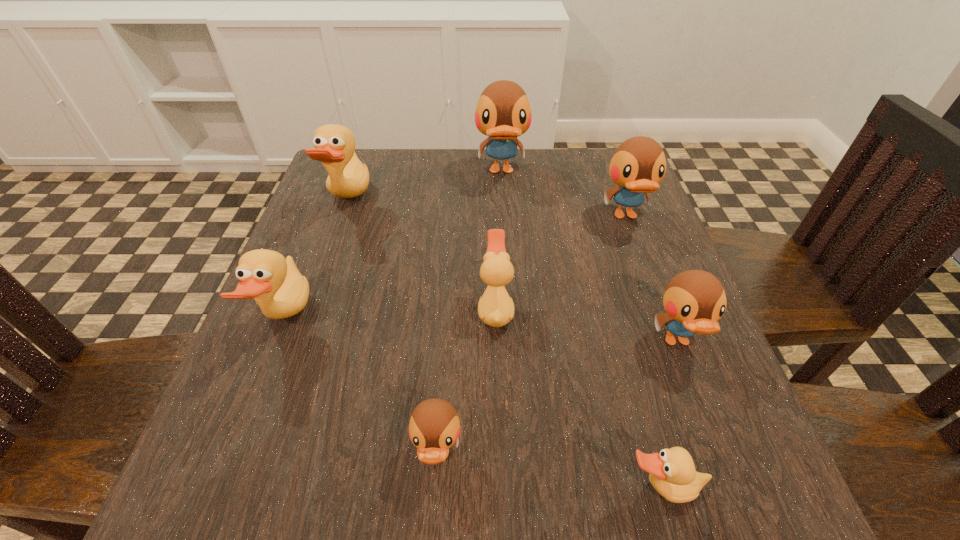
Locate an element on the screen. the rightmost tan duck is located at coordinates (672, 472).

The width and height of the screenshot is (960, 540). What are the coordinates of `vacant area situated on the front-facing side of the farthest blue duck` in the screenshot? It's located at (507, 259).

Locate an element on the screen. The image size is (960, 540). free space located on the beak of the biggest tan duck is located at coordinates point(460,201).

Identify the location of vacant space located on the front-facing side of the third nearest blue duck. The width and height of the screenshot is (960, 540). 654,292.

Image resolution: width=960 pixels, height=540 pixels. Find the location of `free space located 0.360m on the beak of the second biggest tan duck`. free space located 0.360m on the beak of the second biggest tan duck is located at coordinates (511, 318).

Locate an element on the screen. The height and width of the screenshot is (540, 960). vacant space located 0.190m on the front-facing side of the third biggest blue duck is located at coordinates (735, 495).

Image resolution: width=960 pixels, height=540 pixels. What are the coordinates of `vacant area located 0.320m on the beak of the third biggest tan duck` in the screenshot? It's located at (301, 309).

This screenshot has height=540, width=960. Find the location of `vacant position located on the beak of the third biggest tan duck`. vacant position located on the beak of the third biggest tan duck is located at coordinates (422, 309).

Identify the location of free point located 0.210m on the beak of the third biggest tan duck. (362, 309).

I want to click on object that is at the far left corner, so click(334, 145).